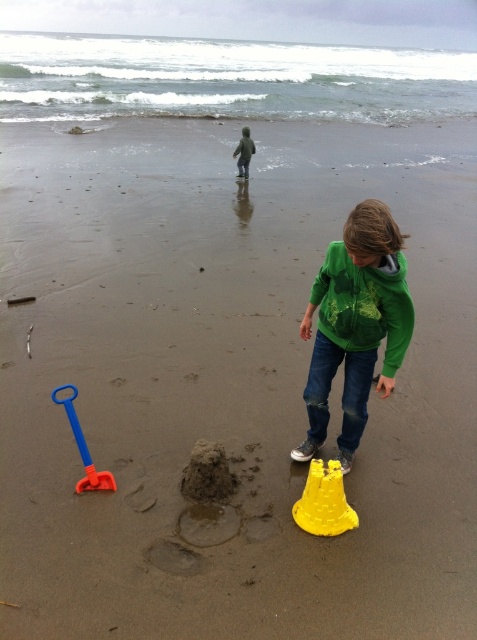
Question: Which point is closer to the camera?

Choices:
 (A) (248, 156)
 (B) (309, 467)
 (C) (345, 282)

Answer: (C)

Question: Which object is closer to the camera taking this photo?

Choices:
 (A) green matte jacket at upper center
 (B) green matte hoodie at center
 (C) green matte jacket at lower right
 (D) blue plastic shovel at lower left

Answer: (B)

Question: Can you confirm if green matte jacket at lower right is thinner than green matte jacket at upper center?

Choices:
 (A) yes
 (B) no

Answer: (B)

Question: Is green matte hoodie at center thinner than green matte jacket at upper center?

Choices:
 (A) no
 (B) yes

Answer: (A)

Question: Can you confirm if blue plastic shovel at lower left is smaller than green matte jacket at upper center?

Choices:
 (A) no
 (B) yes

Answer: (B)

Question: Which of the following is the closest to the observer?

Choices:
 (A) green matte jacket at lower right
 (B) green matte hoodie at center

Answer: (B)